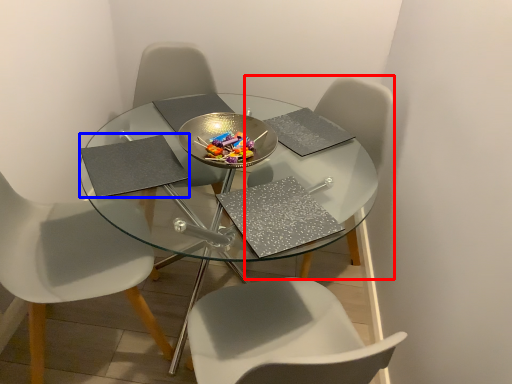
Question: Which object is closer to the camera taking this photo, chair (highlighted by a red box) or pad (highlighted by a blue box)?

Choices:
 (A) chair
 (B) pad

Answer: (B)